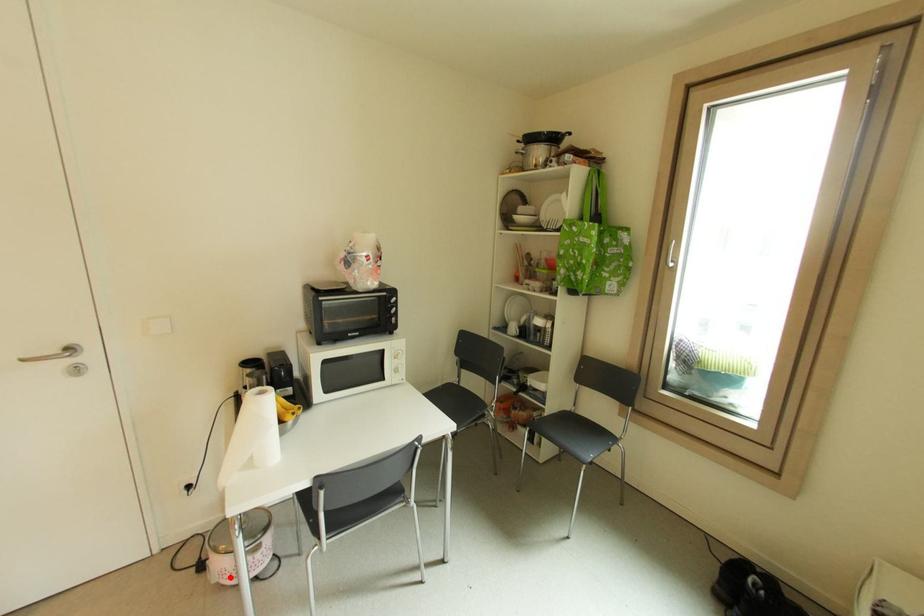
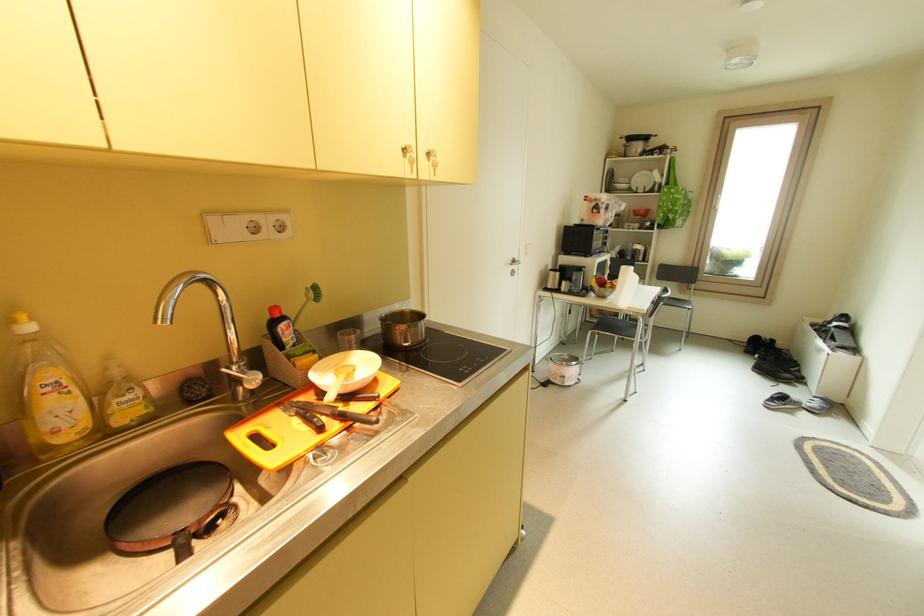
Question: A red point is marked in image1. In image2, is the corresponding 3D point closer to the camera or farther? Reply with the corresponding letter.

Choices:
 (A) The corresponding 3D point is closer.
 (B) The corresponding 3D point is farther.

Answer: (B)